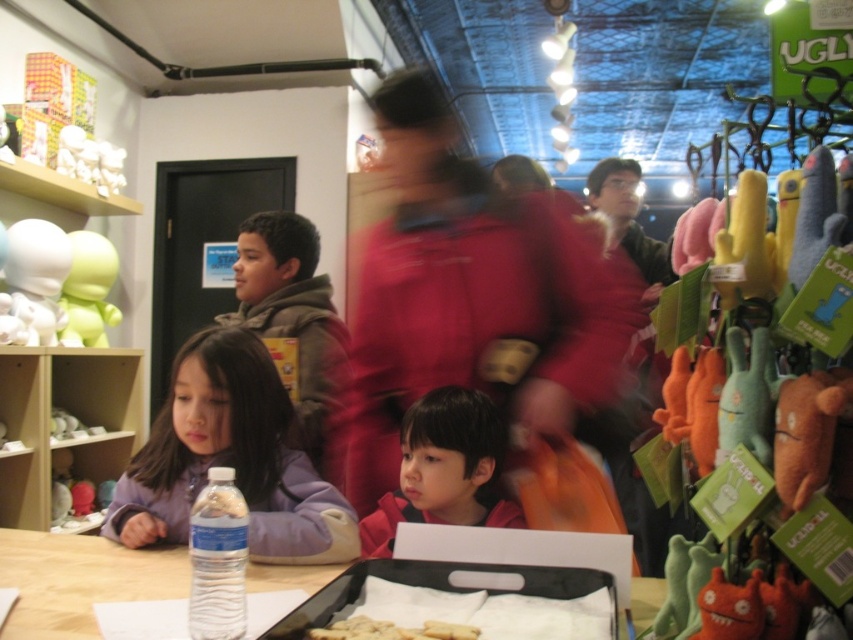
Question: Which point is farther to the camera?

Choices:
 (A) (84, 170)
 (B) (334, 612)

Answer: (A)

Question: Can you confirm if matte white figurine at left is smaller than white crumbly bread at center?

Choices:
 (A) no
 (B) yes

Answer: (A)

Question: Considering the real-world distances, which object is closest to the black plastic tray at lower center?

Choices:
 (A) brown plush toy at right
 (B) white matte plush at upper left

Answer: (A)

Question: Which point appears farthest from the camera in this image?

Choices:
 (A) (368, 566)
 (B) (113, 269)
 (C) (775, 433)

Answer: (B)

Question: Does matte red jacket at center have a larger size compared to matte white figurine at left?

Choices:
 (A) no
 (B) yes

Answer: (A)

Question: Where is black plastic tray at lower center located in relation to white crumbly bread at center in the image?

Choices:
 (A) below
 (B) above

Answer: (B)